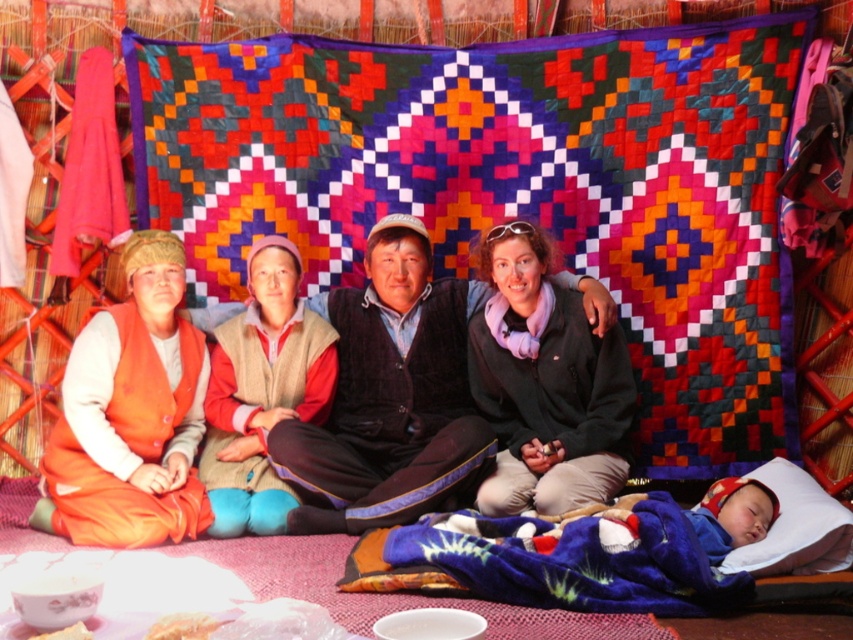
Question: Based on their relative distances, which object is farther from the velvet-like sweater at center?

Choices:
 (A) orange suede vest at left
 (B) blue plush baby at lower right
 (C) black fleece jacket at center
 (D) knitted wool sweater at center

Answer: (B)

Question: Which point is closer to the camera?

Choices:
 (A) knitted wool sweater at center
 (B) orange suede vest at left

Answer: (B)

Question: Which object is farther from the camera taking this photo?

Choices:
 (A) orange suede vest at left
 (B) black fleece jacket at center

Answer: (B)

Question: Is velvet-like sweater at center thinner than blue plush baby at lower right?

Choices:
 (A) yes
 (B) no

Answer: (B)

Question: Does velvet-like sweater at center appear under black fleece jacket at center?

Choices:
 (A) yes
 (B) no

Answer: (A)

Question: Considering the relative positions of orange suede vest at left and blue plush baby at lower right in the image provided, where is orange suede vest at left located with respect to blue plush baby at lower right?

Choices:
 (A) below
 (B) above

Answer: (B)